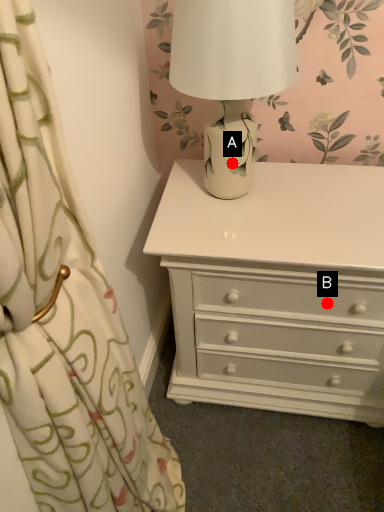
Question: Two points are circled on the image, labeled by A and B beside each circle. Which point appears farthest from the camera in this image?

Choices:
 (A) A is further
 (B) B is further

Answer: (B)